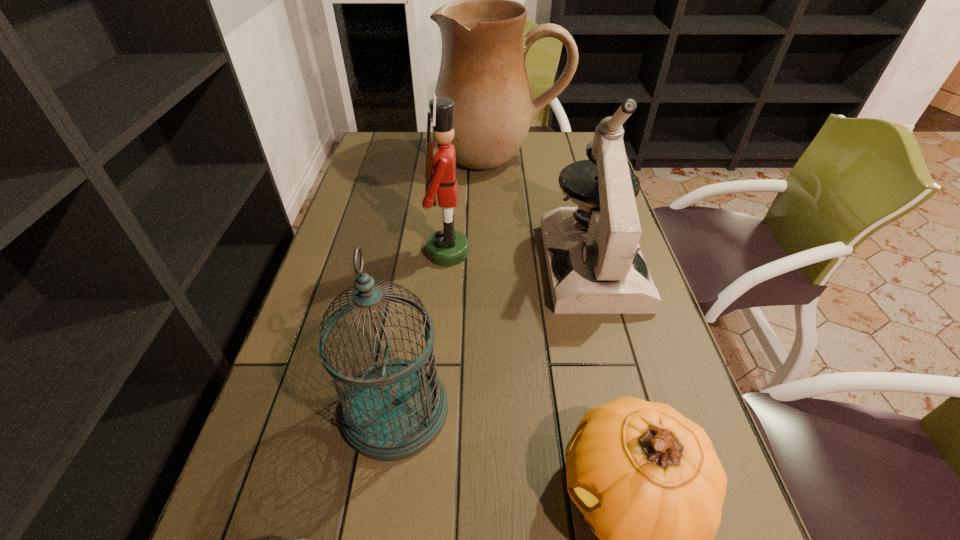
In order to click on object that ranks as the fifth closest to the nutcracker in this screenshot , I will do `click(302, 539)`.

Where is `vacant space that satisfies the following two spatial constraints: 1. at the spout of the farthest object; 2. on the front-facing side of the birdcage`? vacant space that satisfies the following two spatial constraints: 1. at the spout of the farthest object; 2. on the front-facing side of the birdcage is located at coordinates (516, 410).